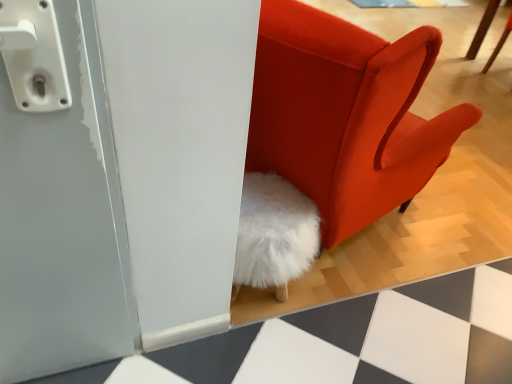
What do you see at coordinates (346, 114) in the screenshot? I see `velvet orange chair at center` at bounding box center [346, 114].

This screenshot has height=384, width=512. What are the coordinates of `velvet orange chair at center` in the screenshot? It's located at 346,114.

This screenshot has width=512, height=384. Describe the element at coordinates (482, 29) in the screenshot. I see `white fluffy chair at upper right` at that location.

You are a GUI agent. You are given a task and a screenshot of the screen. Output one action in this format:
    pyautogui.click(x=<x>, y=<y>)
    Task: Click on the white fluffy chair at upper right
    
    Given the screenshot: What is the action you would take?
    pyautogui.click(x=482, y=29)

Locate an element on the screen. velvet orange chair at center is located at coordinates (346, 114).

Does white fluffy chair at upper right appear on the right side of velvet orange chair at center?

Correct, you'll find white fluffy chair at upper right to the right of velvet orange chair at center.

In the image, is white fluffy chair at upper right positioned in front of or behind velvet orange chair at center?

In the image, white fluffy chair at upper right appears behind velvet orange chair at center.

Between point (495, 3) and point (411, 45), which one is positioned in front?

The point (411, 45) is more forward.

From the image's perspective, which object appears higher, white fluffy chair at upper right or velvet orange chair at center?

white fluffy chair at upper right.

From a real-world perspective, which object rests below the other?

white fluffy chair at upper right, from a real-world perspective.

From the picture: Does white fluffy chair at upper right have a lesser width compared to velvet orange chair at center?

Yes.

Looking at this image, is white fluffy chair at upper right taller than velvet orange chair at center?

No, white fluffy chair at upper right is not taller than velvet orange chair at center.

From the picture: Considering the sizes of objects white fluffy chair at upper right and velvet orange chair at center in the image provided, who is smaller, white fluffy chair at upper right or velvet orange chair at center?

white fluffy chair at upper right.

Is velvet orange chair at center surrounded by white fluffy chair at upper right?

Definitely not — velvet orange chair at center is not inside white fluffy chair at upper right.

Is there a large distance between white fluffy chair at upper right and velvet orange chair at center?

Absolutely, white fluffy chair at upper right is distant from velvet orange chair at center.

Is white fluffy chair at upper right aimed at velvet orange chair at center?

No, white fluffy chair at upper right does not turn towards velvet orange chair at center.

Can you tell me how much white fluffy chair at upper right and velvet orange chair at center differ in facing direction?

They differ by 28.1 degrees in their facing directions.

How distant is white fluffy chair at upper right from velvet orange chair at center?

white fluffy chair at upper right is 8.98 feet from velvet orange chair at center.

The image size is (512, 384). In order to click on furniture above the velvet orange chair at center (from the image's perspective) in this screenshot , I will do `click(482, 29)`.

Would you say velvet orange chair at center is to the left or to the right of white fluffy chair at upper right in the picture?

velvet orange chair at center is to the left of white fluffy chair at upper right.

Considering the positions of objects velvet orange chair at center and white fluffy chair at upper right in the image provided, who is in front, velvet orange chair at center or white fluffy chair at upper right?

velvet orange chair at center is closer to the camera.

Is point (377, 195) more distant than point (485, 14)?

No.

In the scene shown: From the image's perspective, is velvet orange chair at center under white fluffy chair at upper right?

Yes, from the image's perspective, velvet orange chair at center is beneath white fluffy chair at upper right.

From a real-world perspective, is velvet orange chair at center positioned over white fluffy chair at upper right based on gravity?

Yes, from a real-world perspective, velvet orange chair at center is over white fluffy chair at upper right

Considering the sizes of objects velvet orange chair at center and white fluffy chair at upper right in the image provided, who is thinner, velvet orange chair at center or white fluffy chair at upper right?

Thinner between the two is white fluffy chair at upper right.

Between velvet orange chair at center and white fluffy chair at upper right, which one has more height?

velvet orange chair at center.

From the picture: Considering the relative sizes of velvet orange chair at center and white fluffy chair at upper right in the image provided, is velvet orange chair at center smaller than white fluffy chair at upper right?

Result: No.

Is velvet orange chair at center not inside white fluffy chair at upper right?

velvet orange chair at center lies outside white fluffy chair at upper right's area.

Is there a large distance between velvet orange chair at center and white fluffy chair at upper right?

Yes.

Could you tell me if velvet orange chair at center is facing white fluffy chair at upper right?

Yes, velvet orange chair at center is turned towards white fluffy chair at upper right.

What's the angular difference between velvet orange chair at center and white fluffy chair at upper right's facing directions?

28.1 degrees.

Measure the distance from velvet orange chair at center to white fluffy chair at upper right.

velvet orange chair at center and white fluffy chair at upper right are 2.74 meters apart.

The height and width of the screenshot is (384, 512). Find the location of `furniture on the right of velvet orange chair at center`. furniture on the right of velvet orange chair at center is located at coordinates click(482, 29).

You are a GUI agent. You are given a task and a screenshot of the screen. Output one action in this format:
    pyautogui.click(x=<x>, y=<y>)
    Task: Click on the chair in front of the white fluffy chair at upper right
    
    Given the screenshot: What is the action you would take?
    pyautogui.click(x=346, y=114)

Where is `chair above the white fluffy chair at upper right (from a real-world perspective)`? Image resolution: width=512 pixels, height=384 pixels. chair above the white fluffy chair at upper right (from a real-world perspective) is located at coordinates (346, 114).